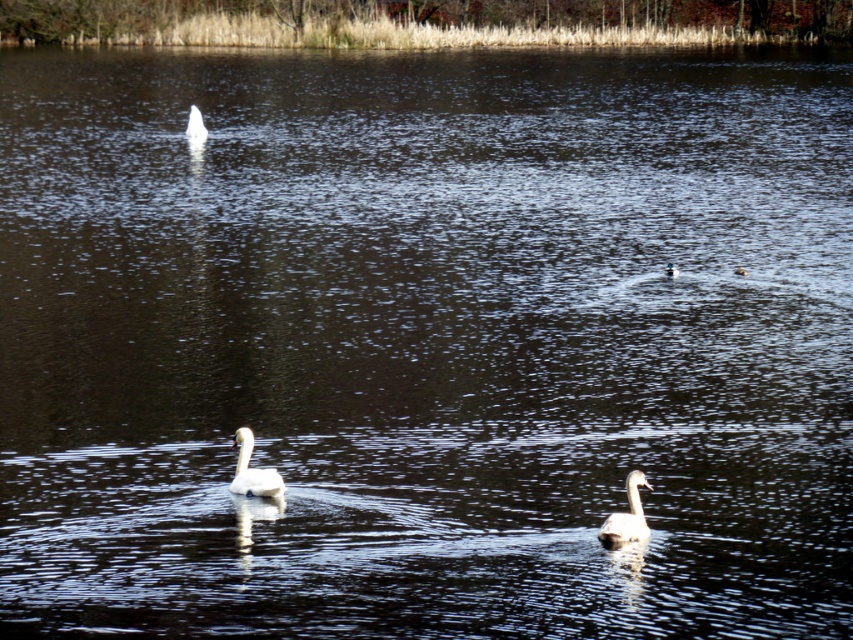
Does white matte swan at center have a lesser height compared to white glossy duck at upper center?

Yes, white matte swan at center is shorter than white glossy duck at upper center.

Does white matte swan at center appear on the right side of white glossy duck at upper center?

Yes, white matte swan at center is to the right of white glossy duck at upper center.

Locate an element on the screen. white matte swan at center is located at coordinates (252, 470).

This screenshot has width=853, height=640. In order to click on white matte swan at center in this screenshot , I will do `click(252, 470)`.

Between point (637, 474) and point (273, 481), which one is positioned in front?

Positioned in front is point (637, 474).

Which is behind, point (622, 541) or point (242, 481)?

Point (242, 481)

The image size is (853, 640). What are the coordinates of `white matte swan at lower right` in the screenshot? It's located at (625, 516).

Which of these two, white matte swan at lower right or brown fuzzy duck at upper right, stands taller?

white matte swan at lower right is taller.

Is white matte swan at lower right behind brown fuzzy duck at upper right?

No, it is in front of brown fuzzy duck at upper right.

Who is more distant from viewer, (635, 508) or (666, 266)?

Point (666, 266)

Image resolution: width=853 pixels, height=640 pixels. In order to click on white matte swan at lower right in this screenshot , I will do `click(625, 516)`.